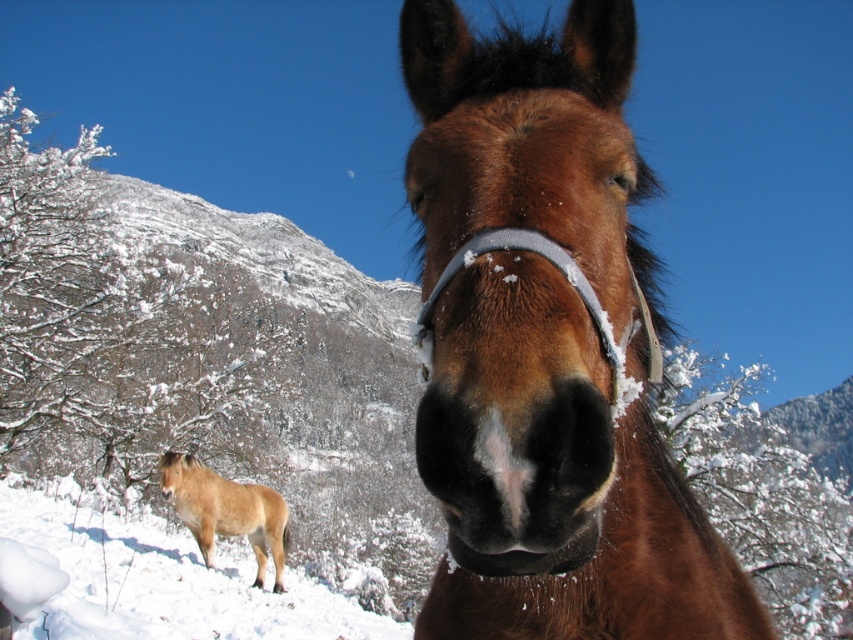
Question: Does brown glossy horse at center lie in front of light brown fur pony at lower left?

Choices:
 (A) no
 (B) yes

Answer: (B)

Question: Observing the image, what is the correct spatial positioning of brown glossy horse at center in reference to light brown fur pony at lower left?

Choices:
 (A) right
 (B) left

Answer: (A)

Question: Is brown glossy horse at center to the right of light brown fur pony at lower left from the viewer's perspective?

Choices:
 (A) no
 (B) yes

Answer: (B)